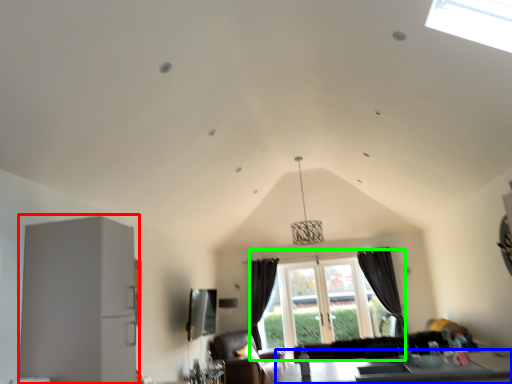
Question: Estimate the real-world distances between objects in this image. Which object is closer to appliance (highlighted by a red box), table (highlighted by a blue box) or window (highlighted by a green box)?

Choices:
 (A) table
 (B) window

Answer: (A)